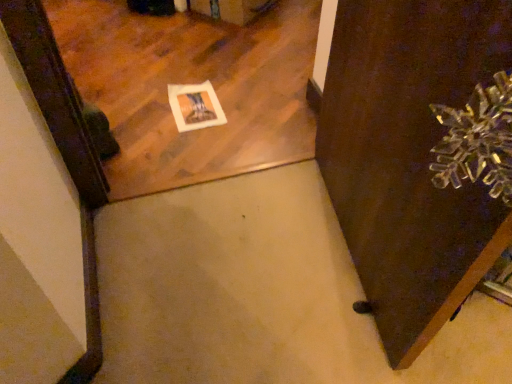
Question: From a real-world perspective, is brown wooden door at right under matte wooden mirror at upper left?

Choices:
 (A) no
 (B) yes

Answer: (A)

Question: Does brown wooden door at right have a larger size compared to matte wooden mirror at upper left?

Choices:
 (A) no
 (B) yes

Answer: (B)

Question: Can we say brown wooden door at right lies outside matte wooden mirror at upper left?

Choices:
 (A) yes
 (B) no

Answer: (A)

Question: Can you confirm if brown wooden door at right is taller than matte wooden mirror at upper left?

Choices:
 (A) no
 (B) yes

Answer: (B)

Question: Could you tell me if brown wooden door at right is turned towards matte wooden mirror at upper left?

Choices:
 (A) yes
 (B) no

Answer: (B)

Question: Does brown wooden door at right have a lesser height compared to matte wooden mirror at upper left?

Choices:
 (A) no
 (B) yes

Answer: (A)

Question: Does matte wooden mirror at upper left have a smaller size compared to brown wooden door at right?

Choices:
 (A) yes
 (B) no

Answer: (A)

Question: Could you tell me if matte wooden mirror at upper left is facing brown wooden door at right?

Choices:
 (A) yes
 (B) no

Answer: (B)

Question: Is matte wooden mirror at upper left at the right side of brown wooden door at right?

Choices:
 (A) yes
 (B) no

Answer: (B)

Question: Is matte wooden mirror at upper left bigger than brown wooden door at right?

Choices:
 (A) yes
 (B) no

Answer: (B)

Question: Does matte wooden mirror at upper left have a lesser width compared to brown wooden door at right?

Choices:
 (A) no
 (B) yes

Answer: (A)

Question: From the image's perspective, is matte wooden mirror at upper left on brown wooden door at right?

Choices:
 (A) no
 (B) yes

Answer: (B)

Question: Based on their sizes in the image, would you say brown wooden door at right is bigger or smaller than matte wooden mirror at upper left?

Choices:
 (A) small
 (B) big

Answer: (B)